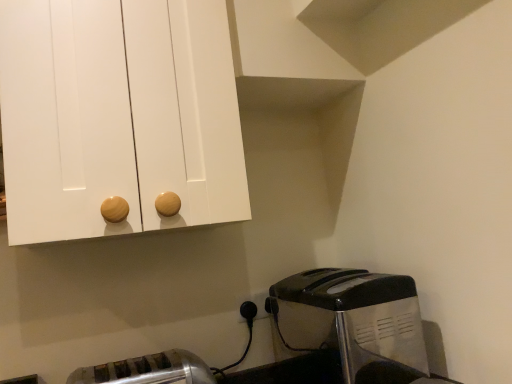
Question: Is white plastic electric outlet at lower center beside metallic silver toaster at lower right, the first toaster in the right-to-left sequence?

Choices:
 (A) yes
 (B) no

Answer: (B)

Question: Does white plastic electric outlet at lower center appear on the left side of metallic silver toaster at lower right, which is the 2th toaster in left-to-right order?

Choices:
 (A) no
 (B) yes

Answer: (B)

Question: Is white plastic electric outlet at lower center taller than metallic silver toaster at lower right, the first toaster in the right-to-left sequence?

Choices:
 (A) yes
 (B) no

Answer: (B)

Question: Considering the relative sizes of white plastic electric outlet at lower center and metallic silver toaster at lower right, the first toaster in the right-to-left sequence, in the image provided, is white plastic electric outlet at lower center bigger than metallic silver toaster at lower right, the first toaster in the right-to-left sequence,?

Choices:
 (A) yes
 (B) no

Answer: (B)

Question: Considering the relative sizes of white plastic electric outlet at lower center and metallic silver toaster at lower right, which is the 2th toaster in left-to-right order, in the image provided, is white plastic electric outlet at lower center smaller than metallic silver toaster at lower right, which is the 2th toaster in left-to-right order,?

Choices:
 (A) yes
 (B) no

Answer: (A)

Question: Considering the relative sizes of white plastic electric outlet at lower center and metallic silver toaster at lower right, which is the 2th toaster in left-to-right order, in the image provided, is white plastic electric outlet at lower center wider than metallic silver toaster at lower right, which is the 2th toaster in left-to-right order,?

Choices:
 (A) no
 (B) yes

Answer: (A)

Question: Is metallic silver toaster at lower right, the first toaster in the right-to-left sequence, at the left side of satin silver toaster at lower left, placed as the first toaster when sorted from left to right?

Choices:
 (A) yes
 (B) no

Answer: (B)

Question: Does metallic silver toaster at lower right, the first toaster in the right-to-left sequence, lie in front of satin silver toaster at lower left, placed as the first toaster when sorted from left to right?

Choices:
 (A) yes
 (B) no

Answer: (B)

Question: From the image's perspective, would you say metallic silver toaster at lower right, the first toaster in the right-to-left sequence, is shown under satin silver toaster at lower left, placed as the first toaster when sorted from left to right?

Choices:
 (A) no
 (B) yes

Answer: (A)

Question: From a real-world perspective, is metallic silver toaster at lower right, which is the 2th toaster in left-to-right order, under satin silver toaster at lower left, which appears as the 2th toaster when viewed from the right?

Choices:
 (A) yes
 (B) no

Answer: (B)

Question: From the image's perspective, is metallic silver toaster at lower right, which is the 2th toaster in left-to-right order, located above satin silver toaster at lower left, which appears as the 2th toaster when viewed from the right?

Choices:
 (A) yes
 (B) no

Answer: (A)

Question: Considering the relative sizes of metallic silver toaster at lower right, which is the 2th toaster in left-to-right order, and satin silver toaster at lower left, which appears as the 2th toaster when viewed from the right, in the image provided, is metallic silver toaster at lower right, which is the 2th toaster in left-to-right order, shorter than satin silver toaster at lower left, which appears as the 2th toaster when viewed from the right,?

Choices:
 (A) no
 (B) yes

Answer: (A)

Question: Is satin silver toaster at lower left, placed as the first toaster when sorted from left to right, next to metallic silver toaster at lower right, the first toaster in the right-to-left sequence?

Choices:
 (A) no
 (B) yes

Answer: (A)